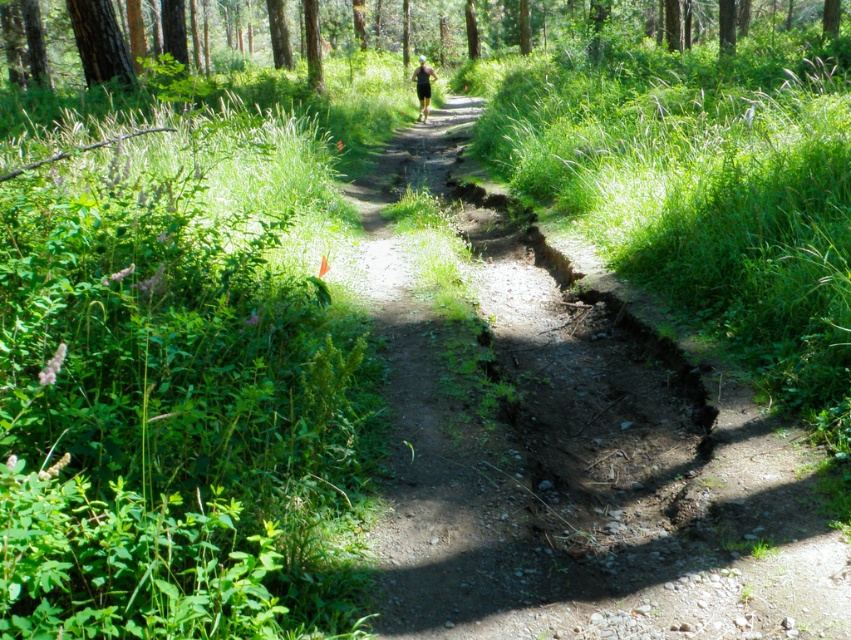
Question: Which point is closer to the camera?

Choices:
 (A) brown textured tree at upper center
 (B) dirt path at center

Answer: (B)

Question: Is dirt path at center wider than black matte shorts at center?

Choices:
 (A) no
 (B) yes

Answer: (B)

Question: Does smooth brown tree trunk at upper left appear over black matte shorts at center?

Choices:
 (A) no
 (B) yes

Answer: (A)

Question: Which object is farther from the camera taking this photo?

Choices:
 (A) brown textured tree at upper center
 (B) dirt path at center
 (C) black matte shorts at center
 (D) smooth brown tree trunk at upper left

Answer: (C)

Question: Does brown textured tree at upper center have a greater width compared to black matte shorts at center?

Choices:
 (A) yes
 (B) no

Answer: (A)

Question: Which object is farther from the camera taking this photo?

Choices:
 (A) smooth brown tree trunk at upper left
 (B) black matte shorts at center
 (C) brown textured tree at upper center

Answer: (B)